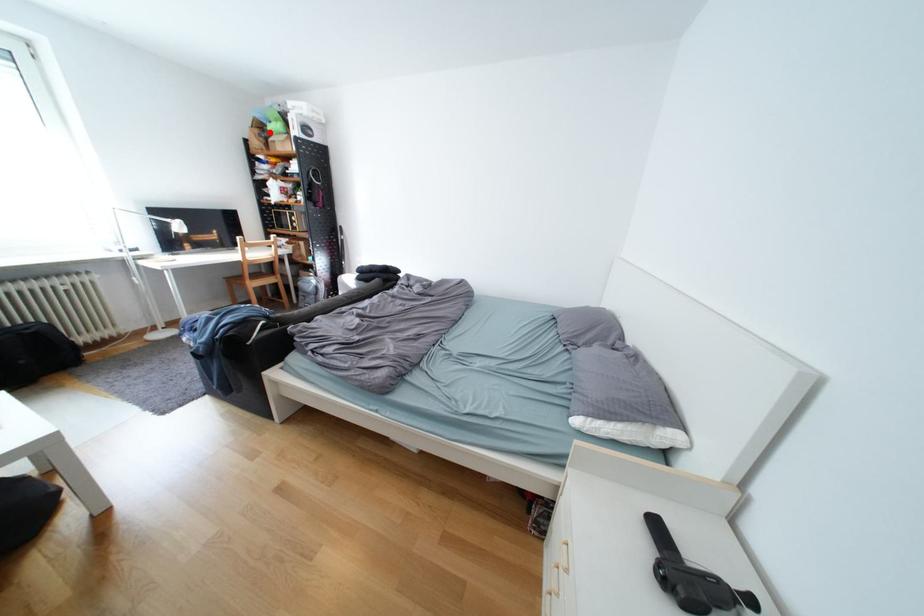
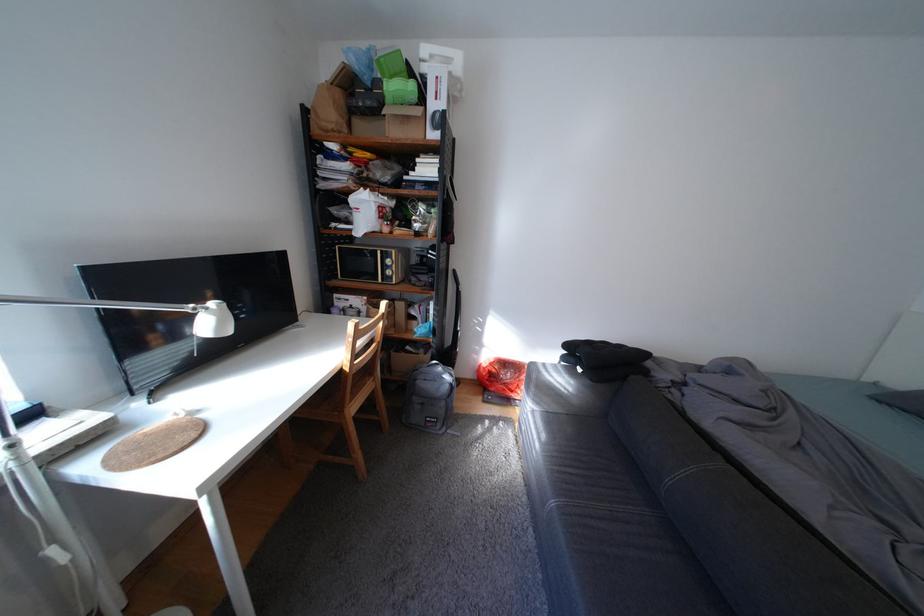
Locate, in the second image, the point that corresponds to the highlighted location in the first image.

(351, 95)